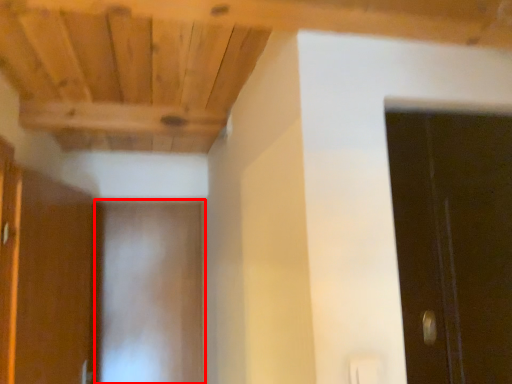
Question: Observing the image, what is the correct spatial positioning of door (annotated by the red box) in reference to cabinetry?

Choices:
 (A) left
 (B) right

Answer: (B)